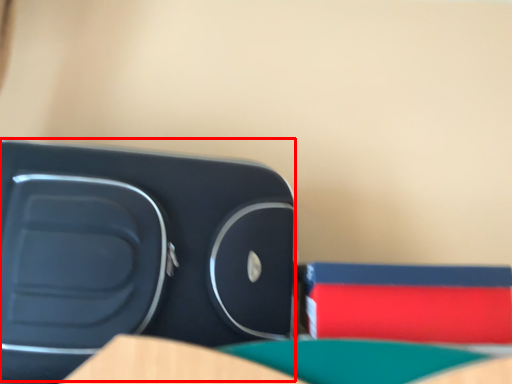
Question: From the image's perspective, where is turquoise (annotated by the red box) located relative to paperback book?

Choices:
 (A) below
 (B) above

Answer: (B)